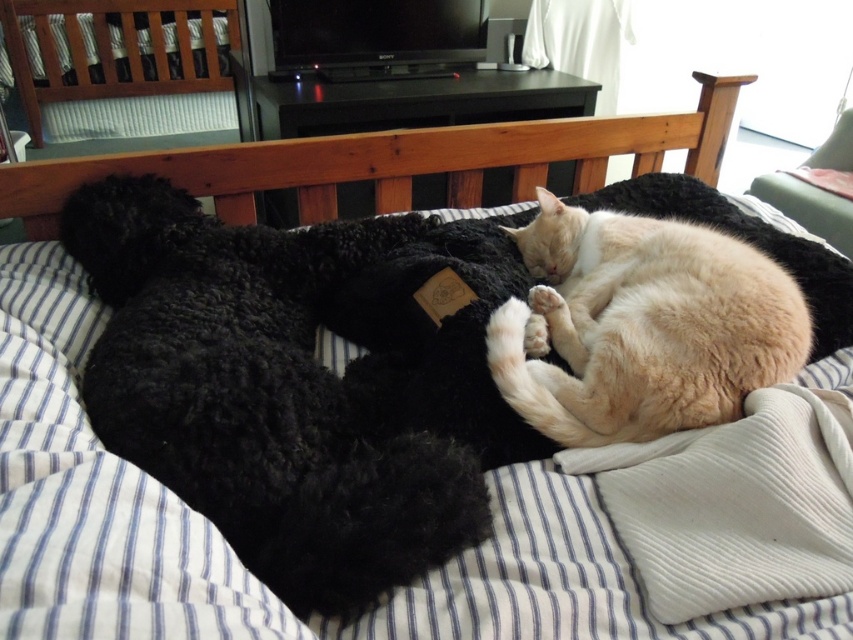
Question: Can you confirm if black fluffy dog at left is positioned to the left of light beige fur cat at center?

Choices:
 (A) no
 (B) yes

Answer: (B)

Question: Does black fluffy dog at left appear on the left side of light beige fur cat at center?

Choices:
 (A) no
 (B) yes

Answer: (B)

Question: Among these points, which one is nearest to the camera?

Choices:
 (A) (236, 348)
 (B) (759, 346)

Answer: (A)

Question: Among these points, which one is farthest from the camera?

Choices:
 (A) (634, 337)
 (B) (318, 492)

Answer: (A)

Question: Which point is farther from the camera taking this photo?

Choices:
 (A) (202, 419)
 (B) (610, 237)

Answer: (B)

Question: Does black fluffy dog at left lie in front of light beige fur cat at center?

Choices:
 (A) no
 (B) yes

Answer: (B)